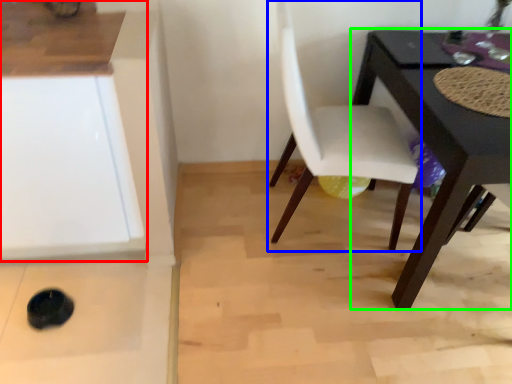
Question: Which is nearer to the cabinetry (highlighted by a red box)? chair (highlighted by a blue box) or table (highlighted by a green box).

Choices:
 (A) chair
 (B) table

Answer: (A)